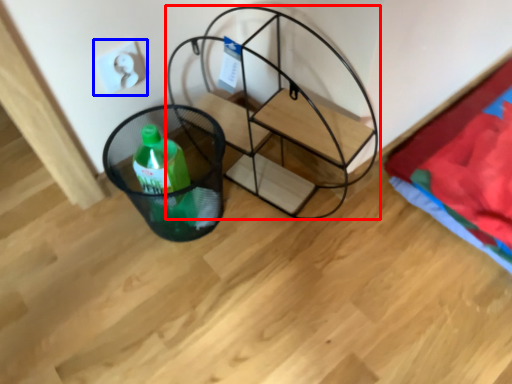
Question: Among these objects, which one is nearest to the camera, furniture (highlighted by a red box) or electric outlet (highlighted by a blue box)?

Choices:
 (A) furniture
 (B) electric outlet

Answer: (A)